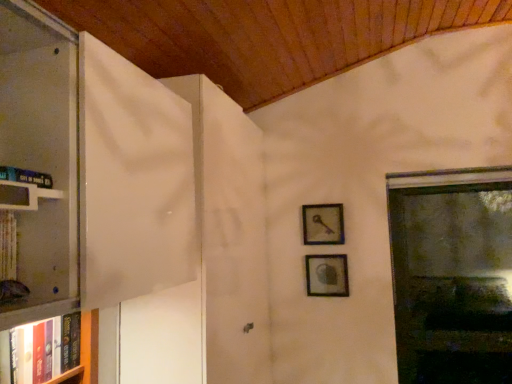
How much space does metallic key at upper right, which is the first picture frame from top to bottom, occupy horizontally?

metallic key at upper right, which is the first picture frame from top to bottom, is 2.49 inches wide.

What do you see at coordinates (323, 224) in the screenshot? I see `metallic key at upper right, which is counted as the second picture frame, starting from the bottom` at bounding box center [323, 224].

You are a GUI agent. You are given a task and a screenshot of the screen. Output one action in this format:
    pyautogui.click(x=<x>, y=<y>)
    Task: Click on the white glossy bookshelf at left
    
    Given the screenshot: What is the action you would take?
    pyautogui.click(x=24, y=195)

Identify the location of hardcover book at left, placed as the 1th book when sorted from front to back. (26, 176).

This screenshot has height=384, width=512. What are the coordinates of `matte silver picture frame at center-right, which appears as the second picture frame when viewed from the top` in the screenshot? It's located at (327, 275).

Where is `metallic key at upper right, which is the first picture frame from top to bottom`? The image size is (512, 384). metallic key at upper right, which is the first picture frame from top to bottom is located at coordinates (323, 224).

Looking at their sizes, would you say hardcover book at left, which is the second book in back-to-front order, is wider or thinner than matte silver picture frame at center-right, the first picture frame when ordered from bottom to top?

In the image, hardcover book at left, which is the second book in back-to-front order, appears to be wider than matte silver picture frame at center-right, the first picture frame when ordered from bottom to top.

From the image's perspective, which one is positioned higher, hardcover book at left, the 1th book positioned from the top, or matte silver picture frame at center-right, the first picture frame when ordered from bottom to top?

hardcover book at left, the 1th book positioned from the top, is shown above in the image.

From a real-world perspective, who is located lower, hardcover book at left, arranged as the second book when ordered from the bottom, or matte silver picture frame at center-right, which appears as the second picture frame when viewed from the top?

From a 3D spatial view, matte silver picture frame at center-right, which appears as the second picture frame when viewed from the top, is below.

Considering their positions, is hardcover book at left, arranged as the second book when ordered from the bottom, located in front of or behind matte silver picture frame at center-right, the first picture frame when ordered from bottom to top?

Clearly, hardcover book at left, arranged as the second book when ordered from the bottom, is in front of matte silver picture frame at center-right, the first picture frame when ordered from bottom to top.

From the image's perspective, is transparent glass window at right positioned above or below hardcover book at left, the first book when ordered from back to front?

From the image's perspective, transparent glass window at right appears below hardcover book at left, the first book when ordered from back to front.

Which of these two, transparent glass window at right or hardcover book at left, marked as the second book in a top-to-bottom arrangement, stands taller?

Standing taller between the two is transparent glass window at right.

Which object is further away from the camera taking this photo, transparent glass window at right or hardcover book at left, positioned as the 1th book in bottom-to-top order?

Positioned behind is transparent glass window at right.

How many degrees apart are the facing directions of transparent glass window at right and hardcover book at left, the first book when ordered from back to front?

The angle between the facing direction of transparent glass window at right and the facing direction of hardcover book at left, the first book when ordered from back to front, is 90.1 degrees.

Who is shorter, hardcover book at left, the 2th book in the front-to-back sequence, or white glossy bookshelf at left?

Standing shorter between the two is white glossy bookshelf at left.

Choose the correct answer: Is hardcover book at left, positioned as the 1th book in bottom-to-top order, inside white glossy bookshelf at left or outside it?

hardcover book at left, positioned as the 1th book in bottom-to-top order, cannot be found inside white glossy bookshelf at left.

Which of these two, hardcover book at left, the first book when ordered from back to front, or white glossy bookshelf at left, is thinner?

With smaller width is white glossy bookshelf at left.

From a real-world perspective, is hardcover book at left, which is the second book in back-to-front order, under hardcover book at left, the 2th book in the front-to-back sequence?

No.

Is hardcover book at left, which is the second book in back-to-front order, positioned with its back to hardcover book at left, marked as the second book in a top-to-bottom arrangement?

No, hardcover book at left, which is the second book in back-to-front order, is not facing away from hardcover book at left, marked as the second book in a top-to-bottom arrangement.

Considering the relative sizes of hardcover book at left, the 1th book positioned from the top, and hardcover book at left, positioned as the 1th book in bottom-to-top order, in the image provided, is hardcover book at left, the 1th book positioned from the top, bigger than hardcover book at left, positioned as the 1th book in bottom-to-top order,?

No, hardcover book at left, the 1th book positioned from the top, is not bigger than hardcover book at left, positioned as the 1th book in bottom-to-top order.

Is transparent glass window at right with matte silver picture frame at center-right, the first picture frame when ordered from bottom to top?

No, transparent glass window at right is not touching matte silver picture frame at center-right, the first picture frame when ordered from bottom to top.

Consider the image. Which object is further away from the camera taking this photo, transparent glass window at right or matte silver picture frame at center-right, which appears as the second picture frame when viewed from the top?

matte silver picture frame at center-right, which appears as the second picture frame when viewed from the top, is further from the camera.

Which is behind, point (501, 207) or point (318, 256)?

Positioned behind is point (501, 207).

Between transparent glass window at right and matte silver picture frame at center-right, which appears as the second picture frame when viewed from the top, which one has more height?

Standing taller between the two is transparent glass window at right.

At what (x,y) coordinates should I click in order to perform the action: click on book that is the 1st object located in front of the transparent glass window at right. Please return your answer as a coordinate pair (x, y). Looking at the image, I should click on (40, 351).

Considering the points (7, 348) and (466, 365), which point is behind, point (7, 348) or point (466, 365)?

The point (466, 365) is farther from the camera.

Is hardcover book at left, the first book when ordered from back to front, wider than transparent glass window at right?

Correct, the width of hardcover book at left, the first book when ordered from back to front, exceeds that of transparent glass window at right.

Is hardcover book at left, the 2th book in the front-to-back sequence, directly adjacent to transparent glass window at right?

hardcover book at left, the 2th book in the front-to-back sequence, is not next to transparent glass window at right, and they're not touching.

Is metallic key at upper right, which is counted as the second picture frame, starting from the bottom, touching hardcover book at left, placed as the 1th book when sorted from front to back?

metallic key at upper right, which is counted as the second picture frame, starting from the bottom, and hardcover book at left, placed as the 1th book when sorted from front to back, are clearly separated.

From a real-world perspective, which is physically above, metallic key at upper right, which is counted as the second picture frame, starting from the bottom, or hardcover book at left, the 1th book positioned from the top?

hardcover book at left, the 1th book positioned from the top.

Is metallic key at upper right, which is the first picture frame from top to bottom, at the left side of hardcover book at left, which is the second book in back-to-front order?

In fact, metallic key at upper right, which is the first picture frame from top to bottom, is to the right of hardcover book at left, which is the second book in back-to-front order.

Can you tell me how much metallic key at upper right, which is the first picture frame from top to bottom, and hardcover book at left, arranged as the second book when ordered from the bottom, differ in facing direction?

The angular difference between metallic key at upper right, which is the first picture frame from top to bottom, and hardcover book at left, arranged as the second book when ordered from the bottom, is 90.1 degrees.

This screenshot has height=384, width=512. In order to click on book that appears above the matte silver picture frame at center-right, which appears as the second picture frame when viewed from the top (from a real-world perspective) in this screenshot , I will do `click(26, 176)`.

Locate an element on the screen. The image size is (512, 384). window lying below the hardcover book at left, positioned as the 1th book in bottom-to-top order (from the image's perspective) is located at coordinates (452, 274).

Consider the image. Looking at the image, which one is located closer to metallic key at upper right, which is counted as the second picture frame, starting from the bottom, hardcover book at left, arranged as the second book when ordered from the bottom, or matte silver picture frame at center-right, which appears as the second picture frame when viewed from the top?

matte silver picture frame at center-right, which appears as the second picture frame when viewed from the top, is closer to metallic key at upper right, which is counted as the second picture frame, starting from the bottom.

From the picture: Based on their spatial positions, is metallic key at upper right, which is counted as the second picture frame, starting from the bottom, or white glossy bookshelf at left further from matte silver picture frame at center-right, which appears as the second picture frame when viewed from the top?

Based on the image, white glossy bookshelf at left appears to be further to matte silver picture frame at center-right, which appears as the second picture frame when viewed from the top.

Estimate the real-world distances between objects in this image. Which object is closer to hardcover book at left, marked as the second book in a top-to-bottom arrangement, transparent glass window at right or metallic key at upper right, which is counted as the second picture frame, starting from the bottom?

metallic key at upper right, which is counted as the second picture frame, starting from the bottom.

Considering their positions, is hardcover book at left, positioned as the 1th book in bottom-to-top order, positioned closer to transparent glass window at right than metallic key at upper right, which is counted as the second picture frame, starting from the bottom?

The object closer to transparent glass window at right is metallic key at upper right, which is counted as the second picture frame, starting from the bottom.

Which object lies further to the anchor point white glossy bookshelf at left, transparent glass window at right or hardcover book at left, arranged as the second book when ordered from the bottom?

The object further to white glossy bookshelf at left is transparent glass window at right.

Based on their spatial positions, is hardcover book at left, placed as the 1th book when sorted from front to back, or metallic key at upper right, which is counted as the second picture frame, starting from the bottom, further from white glossy bookshelf at left?

metallic key at upper right, which is counted as the second picture frame, starting from the bottom, is positioned further to the anchor white glossy bookshelf at left.

Considering their positions, is hardcover book at left, placed as the 1th book when sorted from front to back, positioned further to white glossy bookshelf at left than transparent glass window at right?

transparent glass window at right is further to white glossy bookshelf at left.

From the image, which object appears to be nearer to white glossy bookshelf at left, hardcover book at left, the first book when ordered from back to front, or matte silver picture frame at center-right, which appears as the second picture frame when viewed from the top?

Among the two, hardcover book at left, the first book when ordered from back to front, is located nearer to white glossy bookshelf at left.

Where is `window between white glossy bookshelf at left and metallic key at upper right, which is the first picture frame from top to bottom, from front to back`? The width and height of the screenshot is (512, 384). window between white glossy bookshelf at left and metallic key at upper right, which is the first picture frame from top to bottom, from front to back is located at coordinates (452, 274).

This screenshot has height=384, width=512. What are the coordinates of `window positioned between hardcover book at left, arranged as the second book when ordered from the bottom, and metallic key at upper right, which is counted as the second picture frame, starting from the bottom, from near to far` in the screenshot? It's located at (452, 274).

This screenshot has height=384, width=512. I want to click on book positioned between white glossy bookshelf at left and hardcover book at left, positioned as the 1th book in bottom-to-top order, from near to far, so click(26, 176).

Where is `picture frame between metallic key at upper right, which is the first picture frame from top to bottom, and transparent glass window at right, in the horizontal direction`? picture frame between metallic key at upper right, which is the first picture frame from top to bottom, and transparent glass window at right, in the horizontal direction is located at coordinates tap(327, 275).